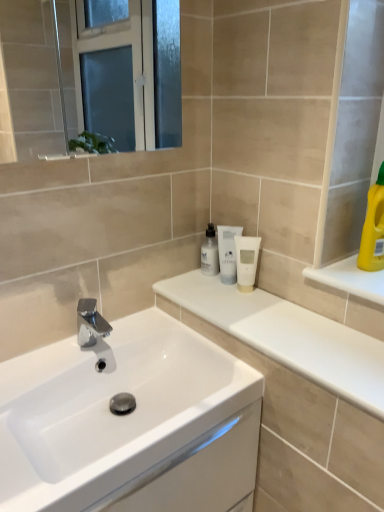
Locate an element on the screen. The height and width of the screenshot is (512, 384). free spot in front of white matte tube at center, positioned as the third mouthwash in left-to-right order is located at coordinates (258, 315).